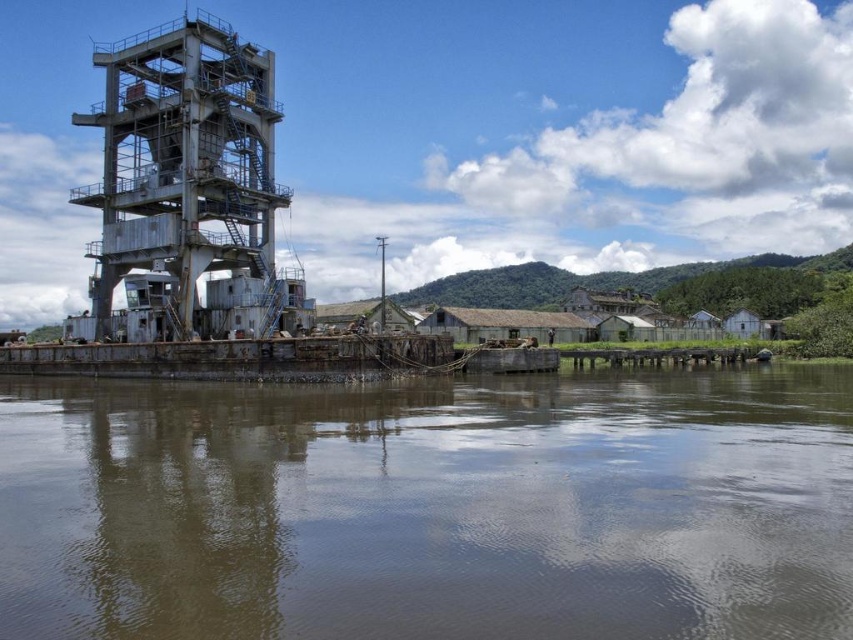
Question: Which object is closer to the camera taking this photo?

Choices:
 (A) rusty metal tower at left
 (B) brown murky water at lower center

Answer: (B)

Question: Is brown murky water at lower center in front of rusty metal tower at left?

Choices:
 (A) no
 (B) yes

Answer: (B)

Question: Can you confirm if brown murky water at lower center is positioned above rusty metal tower at left?

Choices:
 (A) no
 (B) yes

Answer: (A)

Question: Is brown murky water at lower center below rusty metal tower at left?

Choices:
 (A) no
 (B) yes

Answer: (B)

Question: Which object is farther from the camera taking this photo?

Choices:
 (A) rusty metal tower at left
 (B) brown murky water at lower center

Answer: (A)